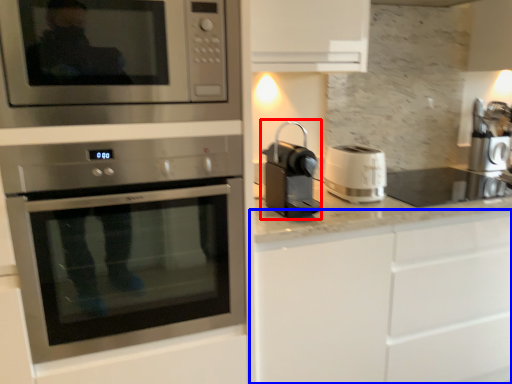
Question: Among these objects, which one is nearest to the camera, coffee machine (highlighted by a red box) or cabinetry (highlighted by a blue box)?

Choices:
 (A) coffee machine
 (B) cabinetry

Answer: (A)